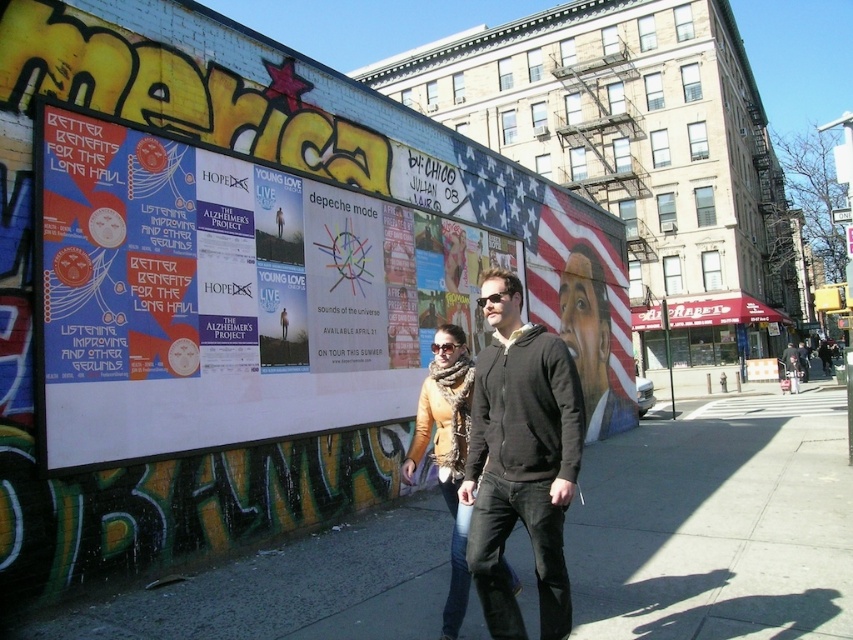
You are an artist standing in front of the wall with the bold yellow letters and colorful posters. You want to place a new poster exactly at the point with coordinates (229, 296). According to the scene description, what is currently at that location?

The point at coordinates (229, 296) corresponds to a white paper poster at center.

Based on the photo, you are standing in front of the wall with the bold yellow letters and colorful posters. You notice two points marked on the wall at coordinates point (360, 198) and point (224, 616). Which point is closer to you?

Point (360, 198) is further to the viewer than point (224, 616). Therefore, point (224, 616) is closer to you.

You are an artist who wants to hang a new poster on the wall. You notice the white paper poster at center and the matte black hoodie at center. Which object is taller and would require more vertical space?

The white paper poster at center is much taller than the matte black hoodie at center, so it would require more vertical space.